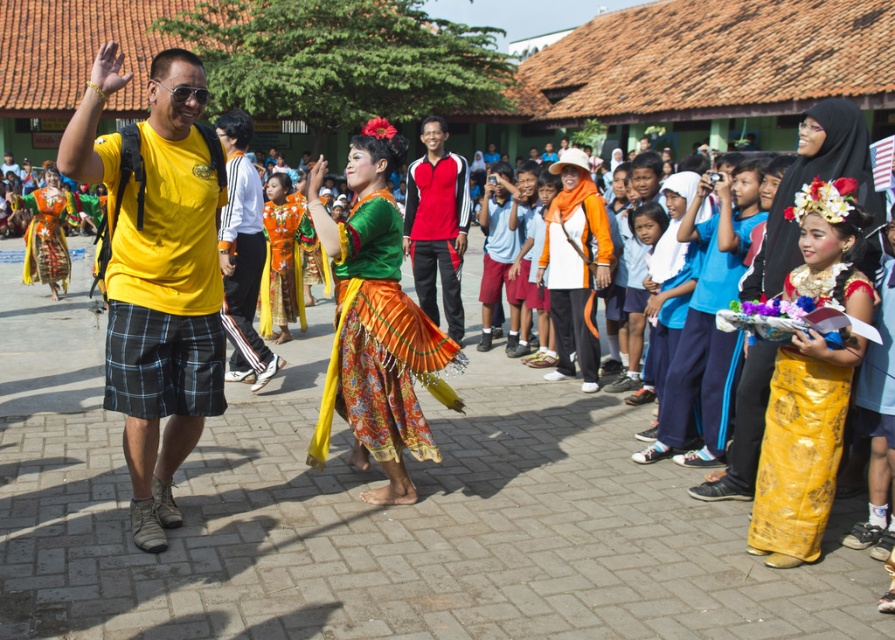
Question: Which of these objects is positioned closest to the shiny yellow skirt at right?

Choices:
 (A) textured silk skirt at center
 (B) red and black sportswear at center

Answer: (A)

Question: Based on their relative distances, which object is farther from the yellow satin dress at right?

Choices:
 (A) red and black sportswear at center
 (B) yellow plaid shorts at left

Answer: (A)

Question: From the image, what is the correct spatial relationship of textured silk skirt at center in relation to shiny yellow skirt at right?

Choices:
 (A) below
 (B) above

Answer: (B)

Question: Is shiny yellow skirt at right further to camera compared to red and black sportswear at center?

Choices:
 (A) yes
 (B) no

Answer: (B)

Question: Can you confirm if yellow plaid shorts at left is positioned to the left of red and black sportswear at center?

Choices:
 (A) no
 (B) yes

Answer: (B)

Question: Which point is closer to the camera?

Choices:
 (A) textured silk skirt at center
 (B) shiny yellow skirt at right
 (C) red and black sportswear at center
 (D) yellow satin dress at right

Answer: (B)